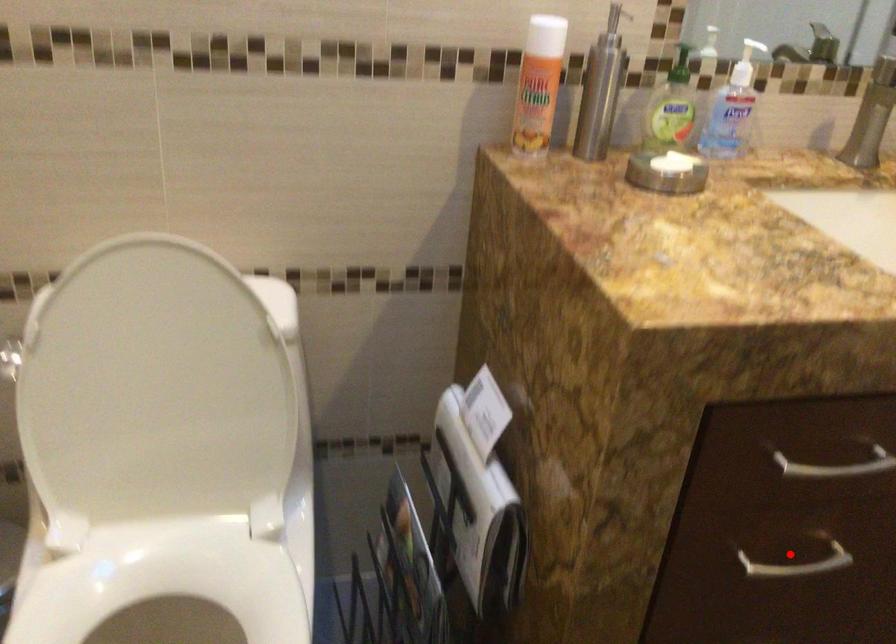
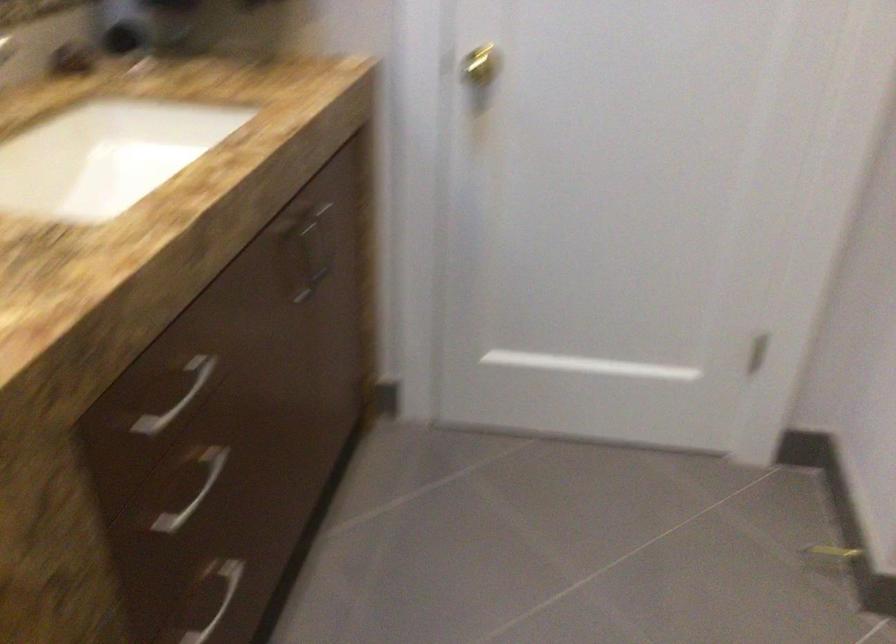
Question: I am providing you with two images of the same scene from different viewpoints. A red point is marked on the first image. Can you still see the location of the red point in image 2?

Choices:
 (A) Yes
 (B) No

Answer: (A)